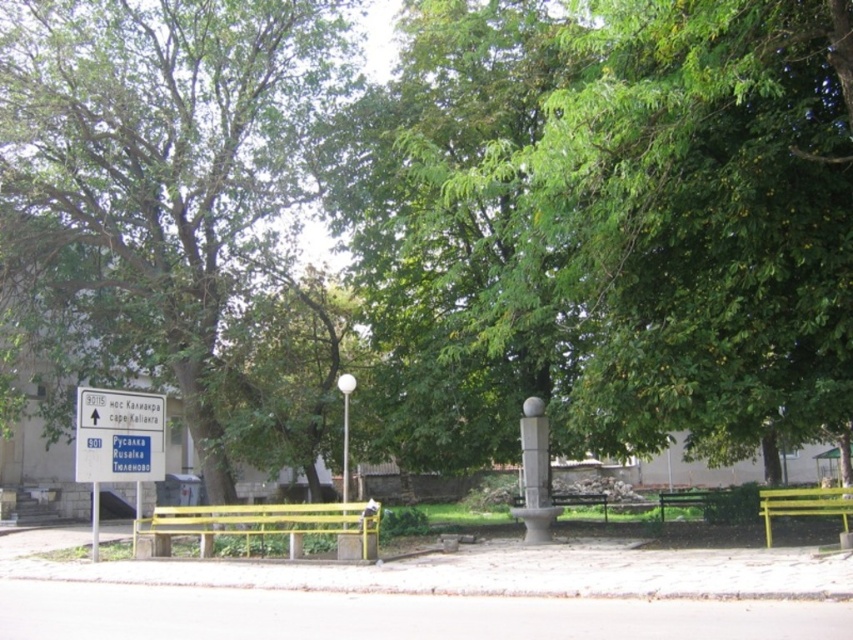
Question: Does green leafy tree at left have a greater width compared to white glossy pole at center?

Choices:
 (A) no
 (B) yes

Answer: (B)

Question: Which point is closer to the camera?

Choices:
 (A) green painted wood bench at lower right
 (B) green leafy tree at left
 (C) white plastic pole at lower left
 (D) white glossy pole at center

Answer: (A)

Question: Is green leafy tree at left positioned before white glossy pole at center?

Choices:
 (A) no
 (B) yes

Answer: (A)

Question: Among these points, which one is nearest to the camera?

Choices:
 (A) (283, 64)
 (B) (91, 556)
 (C) (293, 528)
 (D) (341, 388)

Answer: (C)

Question: Can you confirm if yellow painted wood bench at center is smaller than white glossy pole at center?

Choices:
 (A) yes
 (B) no

Answer: (B)

Question: Among these points, which one is farthest from the camera?

Choices:
 (A) (347, 460)
 (B) (792, 512)

Answer: (A)